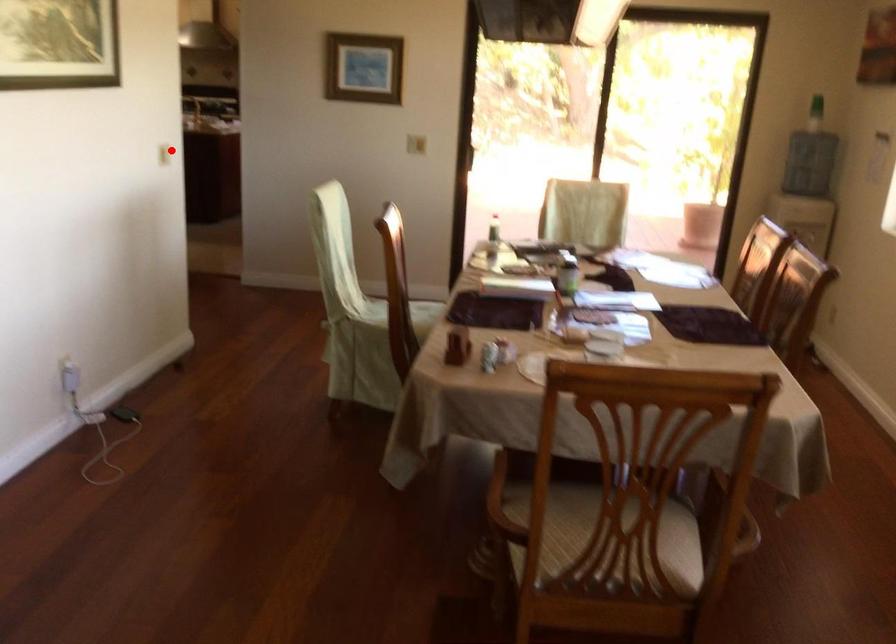
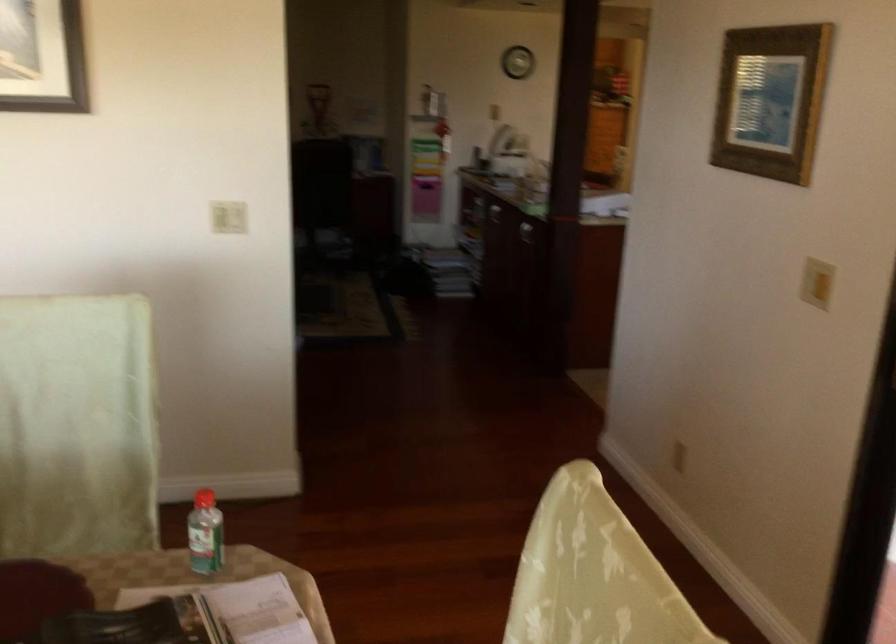
Question: I am providing you with two images of the same scene from different viewpoints. Image1 has a red point marked. In image2, the corresponding 3D location appears at what relative position? Reply with the corresponding letter.

Choices:
 (A) Closer
 (B) Farther

Answer: (A)